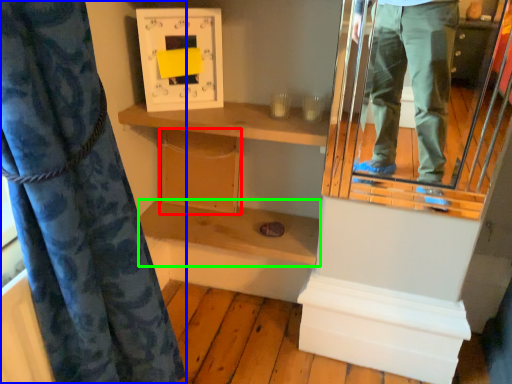
Question: Which object is the closest to the cabinet (highlighted by a red box)? Choose among these: curtain (highlighted by a blue box) or shelf (highlighted by a green box).

Choices:
 (A) curtain
 (B) shelf

Answer: (B)